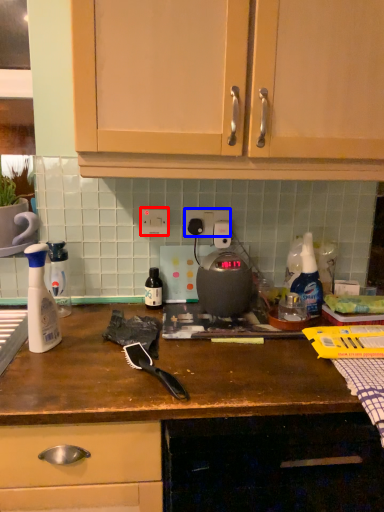
Question: Which of the following is the closest to the observer, electric outlet (highlighted by a red box) or electric outlet (highlighted by a blue box)?

Choices:
 (A) electric outlet
 (B) electric outlet

Answer: (A)